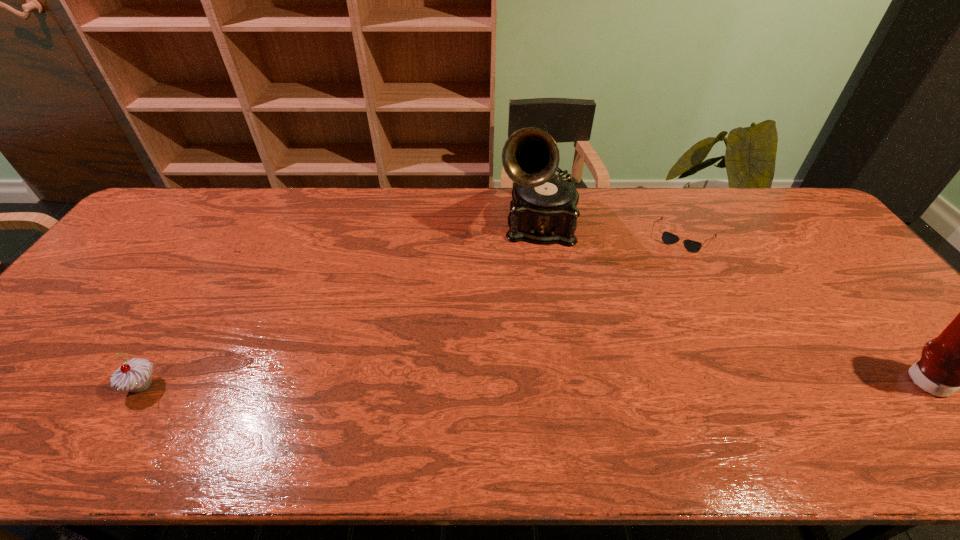
This screenshot has width=960, height=540. Identify the location of free space located on the horn of the phonograph record. (536, 296).

This screenshot has width=960, height=540. Identify the location of free spot located on the horn of the phonograph record. (536, 301).

Locate an element on the screen. This screenshot has width=960, height=540. free space located 0.380m on the horn of the phonograph record is located at coordinates (533, 359).

The image size is (960, 540). Find the location of `sunglasses at the far edge`. sunglasses at the far edge is located at coordinates (668, 238).

You are a GUI agent. You are given a task and a screenshot of the screen. Output one action in this format:
    pyautogui.click(x=<x>, y=<y>)
    Task: Click on the phonograph record present at the far edge
    The width and height of the screenshot is (960, 540).
    Given the screenshot: What is the action you would take?
    pyautogui.click(x=543, y=210)

Where is `object that is at the near edge`? The width and height of the screenshot is (960, 540). object that is at the near edge is located at coordinates (135, 375).

Where is `free space at the far edge of the desktop`? Image resolution: width=960 pixels, height=540 pixels. free space at the far edge of the desktop is located at coordinates (708, 208).

This screenshot has height=540, width=960. In the image, there is a desktop. Identify the location of vacant region at the near edge. (492, 383).

Where is `vacant area at the left edge of the desktop`? This screenshot has height=540, width=960. vacant area at the left edge of the desktop is located at coordinates (168, 246).

In the image, there is a desktop. Where is `vacant area at the right edge`? The width and height of the screenshot is (960, 540). vacant area at the right edge is located at coordinates (813, 254).